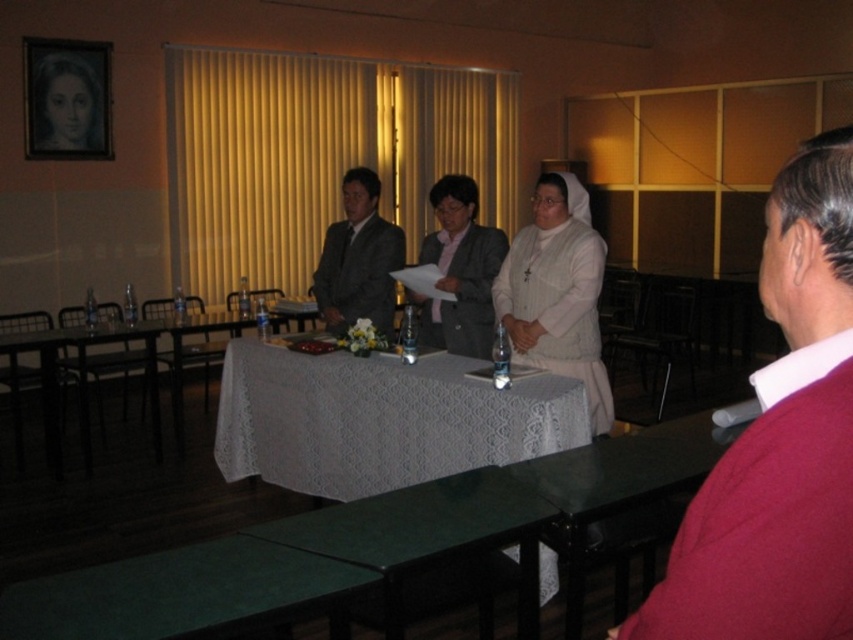
Question: Does maroon sweater at right appear on the left side of dark gray wool business suit at center?

Choices:
 (A) no
 (B) yes

Answer: (A)

Question: Which of the following is the farthest from the observer?

Choices:
 (A) (398, 624)
 (B) (355, 291)
 (C) (300, 572)

Answer: (B)

Question: Considering the real-world distances, which object is closest to the white lace tablecloth at center?

Choices:
 (A) wooden portrait at upper left
 (B) matte gray suit at center

Answer: (B)

Question: Which point appears farthest from the camera in this image?

Choices:
 (A) (349, 520)
 (B) (53, 58)
 (C) (381, 465)
 (D) (809, 577)

Answer: (B)

Question: Is green matte table at lower center closer to camera compared to wooden portrait at upper left?

Choices:
 (A) no
 (B) yes

Answer: (B)

Question: Does white lace tablecloth at center have a larger size compared to green matte table at center?

Choices:
 (A) yes
 (B) no

Answer: (A)